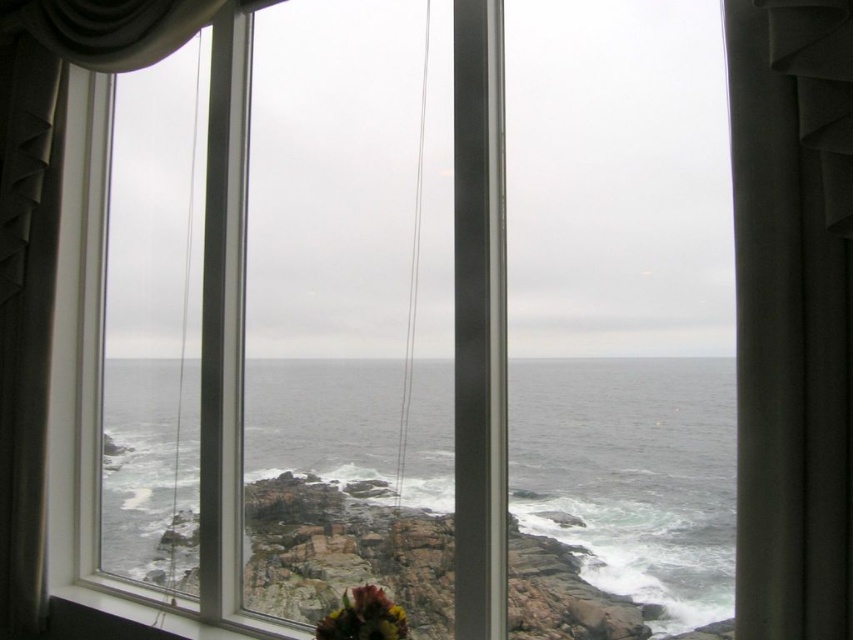
You are standing in a room with a window. You see the gray matte water at center and the multicolored fabric flower at bottom center. Which object is closer to the right side of the window?

The gray matte water at center is to the right of the multicolored fabric flower at bottom center, so it is closer to the right side of the window.

You are an interior designer assessing the room for a client who wants to ensure that the multicolored fabric flower at bottom center is more prominent than the gray matte water at center in the window view. Based on the scene description, can you confirm if the flower is visually larger than the water in the image?

The gray matte water at center might be wider than multicolored fabric flower at bottom center, so the flower may not be visually larger than the water in the image.

You are standing in a room and looking through the window. You see the satin fabric curtain at left and the multicolored fabric flower at bottom center. Which object is closer to you?

The satin fabric curtain at left is closer to you because it is further to the viewer than the multicolored fabric flower at bottom center.